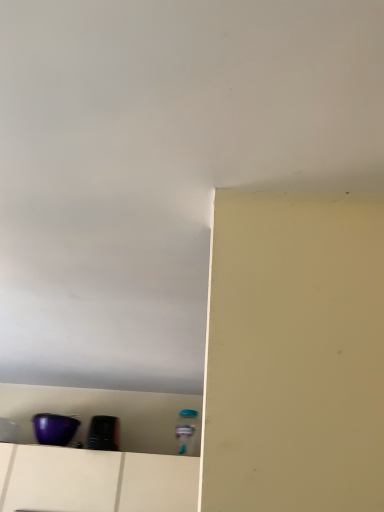
Question: Is purple glossy bowl at lower left, the 1th appliance viewed from the left, facing towards purple plastic container at lower left?

Choices:
 (A) no
 (B) yes

Answer: (A)

Question: Can you confirm if purple glossy bowl at lower left, the 2th appliance from the right, is positioned to the right of purple plastic container at lower left?

Choices:
 (A) yes
 (B) no

Answer: (B)

Question: Can you see purple glossy bowl at lower left, the 2th appliance from the right, touching purple plastic container at lower left?

Choices:
 (A) yes
 (B) no

Answer: (B)

Question: Is purple glossy bowl at lower left, the 1th appliance viewed from the left, behind purple plastic container at lower left?

Choices:
 (A) yes
 (B) no

Answer: (A)

Question: Is purple glossy bowl at lower left, the 1th appliance viewed from the left, taller than purple plastic container at lower left?

Choices:
 (A) no
 (B) yes

Answer: (A)

Question: Is purple plastic container at lower left inside the boundaries of white matte drawer at lower left, or outside?

Choices:
 (A) outside
 (B) inside

Answer: (B)

Question: Looking at the image, does purple plastic container at lower left seem bigger or smaller compared to white matte drawer at lower left?

Choices:
 (A) big
 (B) small

Answer: (A)

Question: From a real-world perspective, is purple plastic container at lower left above or below white matte drawer at lower left?

Choices:
 (A) above
 (B) below

Answer: (A)

Question: Considering the positions of purple plastic container at lower left and white matte drawer at lower left in the image, is purple plastic container at lower left taller or shorter than white matte drawer at lower left?

Choices:
 (A) tall
 (B) short

Answer: (A)

Question: Considering their positions, is black glossy toaster at lower left, positioned as the first appliance in right-to-left order, located in front of or behind white matte drawer at lower left?

Choices:
 (A) front
 (B) behind

Answer: (B)

Question: From a real-world perspective, relative to white matte drawer at lower left, is black glossy toaster at lower left, the 2th appliance in the left-to-right sequence, vertically above or below?

Choices:
 (A) above
 (B) below

Answer: (A)

Question: Based on their sizes in the image, would you say black glossy toaster at lower left, the 2th appliance in the left-to-right sequence, is bigger or smaller than white matte drawer at lower left?

Choices:
 (A) big
 (B) small

Answer: (B)

Question: Does point (112, 437) appear closer or farther from the camera than point (57, 449)?

Choices:
 (A) closer
 (B) farther

Answer: (B)

Question: Is purple plastic container at lower left wider or thinner than black glossy toaster at lower left, the 2th appliance in the left-to-right sequence?

Choices:
 (A) thin
 (B) wide

Answer: (B)

Question: In terms of height, does purple plastic container at lower left look taller or shorter compared to black glossy toaster at lower left, positioned as the first appliance in right-to-left order?

Choices:
 (A) tall
 (B) short

Answer: (A)